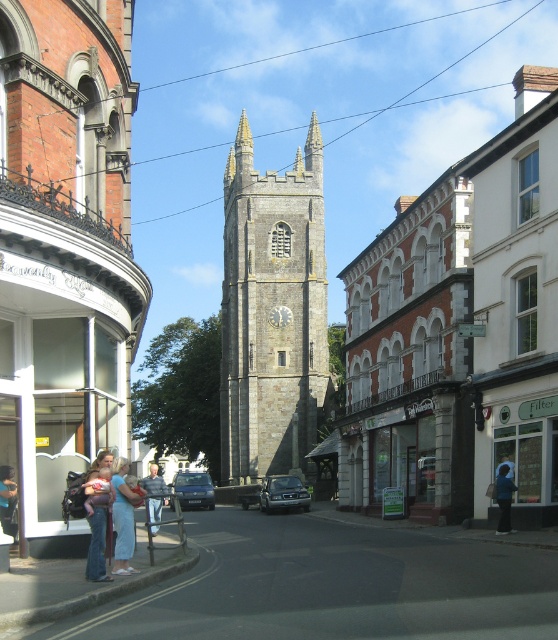
Between stone tower at center and metallic silver sedan at center, which one is positioned lower?

metallic silver sedan at center is lower down.

Does stone tower at center appear on the left side of metallic silver sedan at center?

Yes, stone tower at center is to the left of metallic silver sedan at center.

From the picture: Who is more distant from viewer, (0, 291) or (273, 493)?

Positioned behind is point (273, 493).

In order to click on stone tower at center in this screenshot , I will do `click(64, 244)`.

Who is more forward, (449, 460) or (127, 493)?

Point (127, 493) is in front.

Between point (497, 349) and point (117, 568), which one is positioned behind?

Positioned behind is point (497, 349).

Locate an element on the screen. white brick church at center is located at coordinates (459, 330).

Does gray stone clock tower at center appear on the left side of metallic blue car at center?

Incorrect, gray stone clock tower at center is not on the left side of metallic blue car at center.

Is gray stone clock tower at center to the right of metallic blue car at center from the viewer's perspective?

Indeed, gray stone clock tower at center is positioned on the right side of metallic blue car at center.

Identify the location of gray stone clock tower at center. (271, 310).